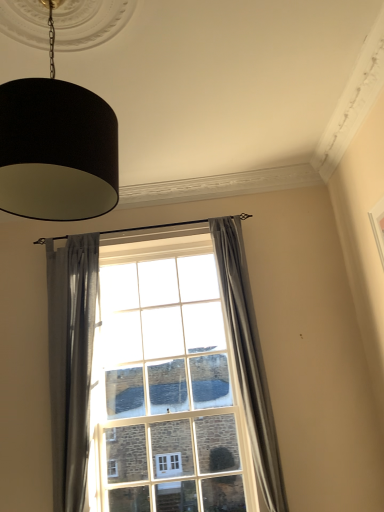
Question: Considering their positions, is clear glass window at center located in front of or behind gray fabric curtain at center, placed as the second curtain when sorted from left to right?

Choices:
 (A) behind
 (B) front

Answer: (A)

Question: From a real-world perspective, is clear glass window at center above or below gray fabric curtain at center, placed as the second curtain when sorted from left to right?

Choices:
 (A) below
 (B) above

Answer: (A)

Question: Estimate the real-world distances between objects in this image. Which object is closer to the gray fabric curtain at center, placed as the second curtain when sorted from left to right?

Choices:
 (A) clear glass window at center
 (B) black fabric lampshade at upper left
 (C) satin gray curtain at left, which is counted as the 1th curtain, starting from the left

Answer: (A)

Question: Estimate the real-world distances between objects in this image. Which object is closer to the gray fabric curtain at center, placed as the second curtain when sorted from left to right?

Choices:
 (A) clear glass window at center
 (B) satin gray curtain at left, which is counted as the 1th curtain, starting from the left
 (C) black fabric lampshade at upper left

Answer: (A)